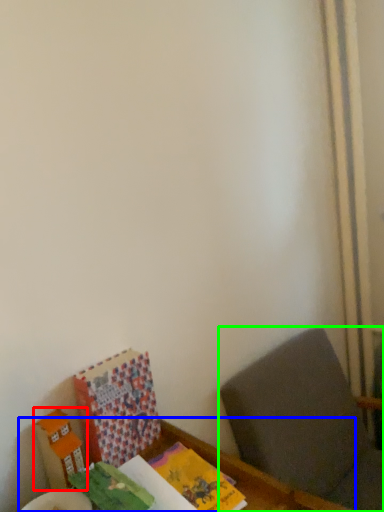
Question: Considering the real-world distances, which object is closest to cardboard box (highlighted by a red box)? table (highlighted by a blue box) or furniture (highlighted by a green box).

Choices:
 (A) table
 (B) furniture

Answer: (A)